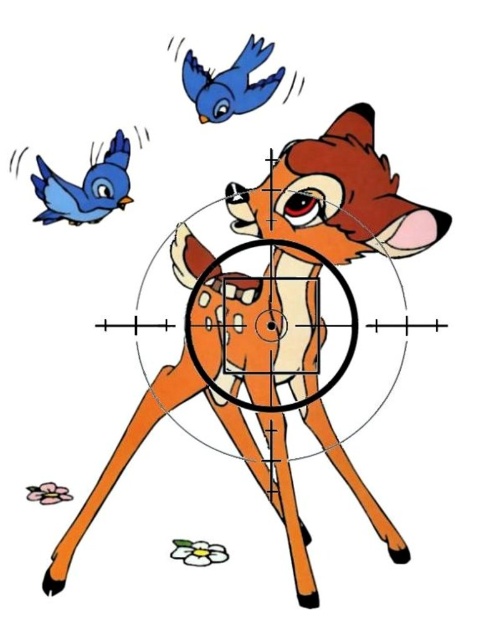
You are an archer aiming at the orange matte deer at center. There is also a matte blue bird at upper left in the background. Will your arrow hit the deer if you aim directly at it?

The orange matte deer at center is below the matte blue bird at upper left, so if you aim directly at the deer, your arrow will hit it before reaching the bird. However, the bird is in the background, so the arrow might pass by the bird and hit the deer.

You are a game developer designing a targeting system for a hunting game. The deer is positioned at the center of the crosshair. However, the deer is actually located at coordinates different from the crosshair center. According to the scene description, where is the orange matte deer at center located?

The orange matte deer at center is located at coordinates point (335, 196), which is slightly to the left and lower than the crosshair center.